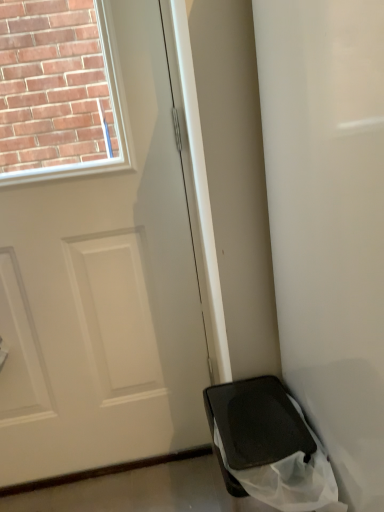
Where is `empty space that is ontop of black matte trash can at lower right`? empty space that is ontop of black matte trash can at lower right is located at coordinates (263, 417).